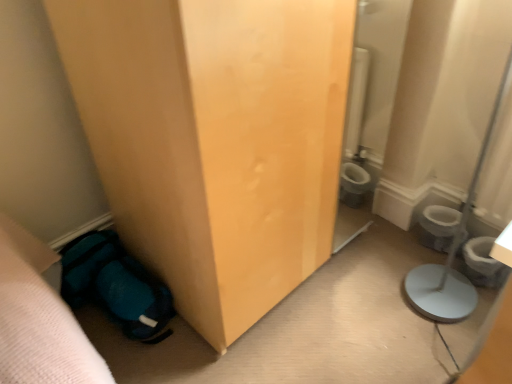
Question: Is white glossy toilet bowl at lower right bigger or smaller than white plastic potty at lower right?

Choices:
 (A) big
 (B) small

Answer: (A)

Question: From the image's perspective, is white glossy toilet bowl at lower right above or below white plastic potty at lower right?

Choices:
 (A) above
 (B) below

Answer: (A)

Question: Which of these objects is positioned farthest from the white plastic potty at lower right?

Choices:
 (A) white glossy toilet bowl at lower right
 (B) teal fabric sleeping bag at lower left

Answer: (B)

Question: Which object is positioned closest to the white glossy toilet bowl at lower right?

Choices:
 (A) teal fabric sleeping bag at lower left
 (B) white plastic potty at lower right

Answer: (B)